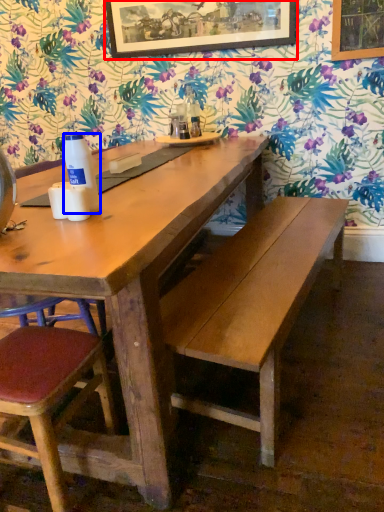
Question: Which of the following is the closest to the observer, picture frame (highlighted by a red box) or bottle (highlighted by a blue box)?

Choices:
 (A) picture frame
 (B) bottle

Answer: (B)